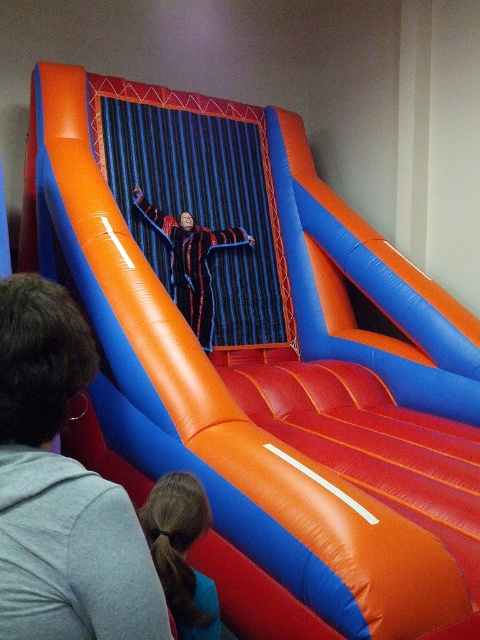
Question: Which object is the farthest from the black textured jumpsuit at center?

Choices:
 (A) smooth brown hair at lower center
 (B) matte black jacket at upper center

Answer: (B)

Question: Does matte black jacket at upper center appear on the left side of black textured jumpsuit at center?

Choices:
 (A) yes
 (B) no

Answer: (B)

Question: Can you confirm if smooth brown hair at lower center is positioned below black textured jumpsuit at center?

Choices:
 (A) no
 (B) yes

Answer: (B)

Question: Is matte black jacket at upper center wider than black textured jumpsuit at center?

Choices:
 (A) no
 (B) yes

Answer: (A)

Question: Which point is closer to the camera taking this photo?

Choices:
 (A) (155, 577)
 (B) (201, 317)
 (C) (200, 580)

Answer: (A)

Question: Which of the following is the farthest from the observer?

Choices:
 (A) (22, 449)
 (B) (194, 620)
 (C) (195, 273)

Answer: (C)